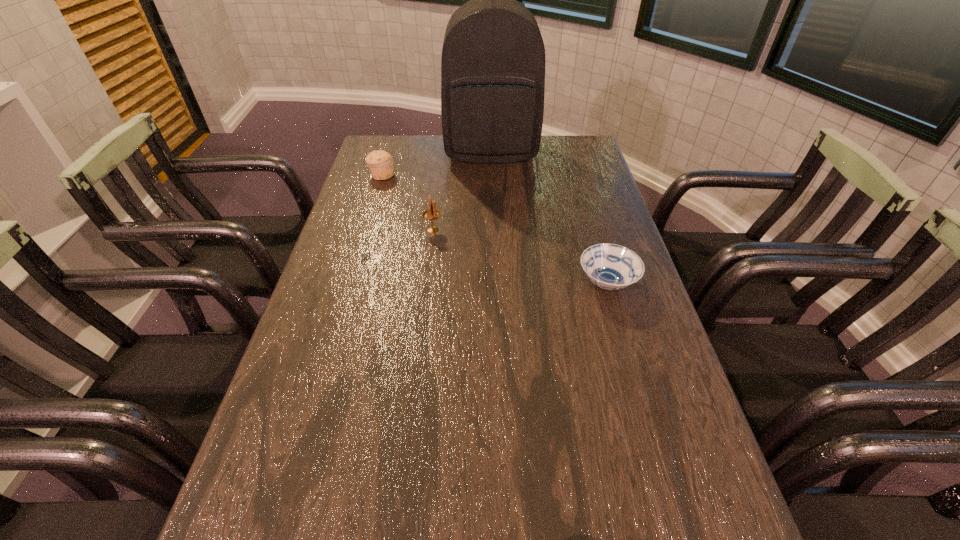
Where is `free region located 0.060m on the left of the rightmost object`? The width and height of the screenshot is (960, 540). free region located 0.060m on the left of the rightmost object is located at coordinates (553, 284).

Where is `object that is at the far edge`? This screenshot has height=540, width=960. object that is at the far edge is located at coordinates (493, 58).

You are a GUI agent. You are given a task and a screenshot of the screen. Output one action in this format:
    pyautogui.click(x=<x>, y=<y>)
    Task: Click on the object at the left edge
    
    Given the screenshot: What is the action you would take?
    pyautogui.click(x=380, y=162)

You are a GUI agent. You are given a task and a screenshot of the screen. Output one action in this format:
    pyautogui.click(x=<x>, y=<y>)
    Task: Click on the object present at the right edge
    
    Given the screenshot: What is the action you would take?
    pyautogui.click(x=610, y=266)

The height and width of the screenshot is (540, 960). In order to click on vacant region at the far edge of the desktop in this screenshot , I will do `click(516, 166)`.

In the image, there is a desktop. Where is `free space at the left edge`? The width and height of the screenshot is (960, 540). free space at the left edge is located at coordinates (364, 190).

In the image, there is a desktop. Identify the location of free space at the right edge. (567, 187).

At what (x,y) coordinates should I click in order to perform the action: click on free space at the far right corner of the desktop. Please return your answer as a coordinate pair (x, y). This screenshot has width=960, height=540. Looking at the image, I should click on (574, 134).

The image size is (960, 540). I want to click on empty space between the rightmost object and the third farthest object, so click(520, 256).

Image resolution: width=960 pixels, height=540 pixels. In order to click on blank region between the third shortest object and the nearest object in this screenshot , I will do `click(520, 256)`.